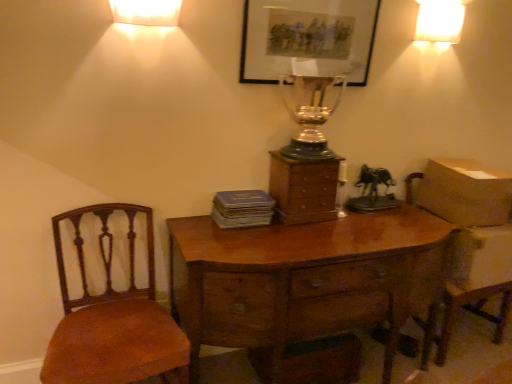
At what (x,y) coordinates should I click in order to perform the action: click on free spot above white glossy lampshade at upper right, arranged as the 1th lamp when viewed from the right (from a real-world perspective). Please return your answer as a coordinate pair (x, y). This screenshot has width=512, height=384. Looking at the image, I should click on (444, 1).